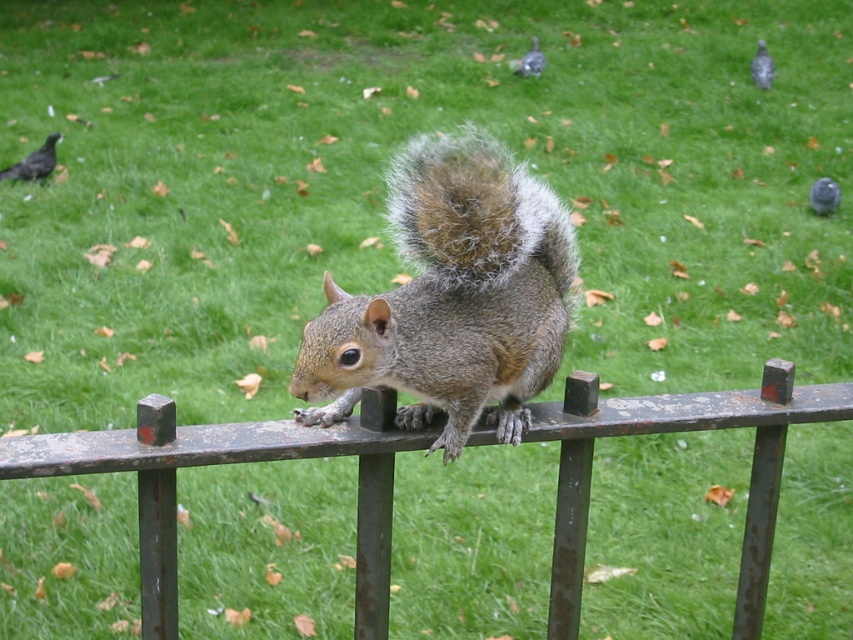
From the picture: You are a park visitor trying to locate the rusty metal fence at center. Based on the coordinates provided, can you determine its position relative to other landmarks in the park?

The rusty metal fence at center is located at coordinates point (230, 461), which means it is positioned towards the lower right area of the image.

You are a photographer aiming to capture both the shiny black bird at upper left and the matte gray pigeon at upper right in a single frame. Based on their positions, which bird should you adjust your camera to focus on first to ensure both are in the shot?

The shiny black bird at upper left is to the left of the matte gray pigeon at upper right, so you should focus on the matte gray pigeon at upper right first to ensure both birds are within the frame.

You are a photographer trying to capture the squirrel on the fence. You notice two birds in the background. Which bird, the shiny black bird at upper left or the gray matte pigeon at upper right, would appear larger in your photo?

The shiny black bird at upper left would appear larger in the photo because it is closer to the viewer than the gray matte pigeon at upper right.